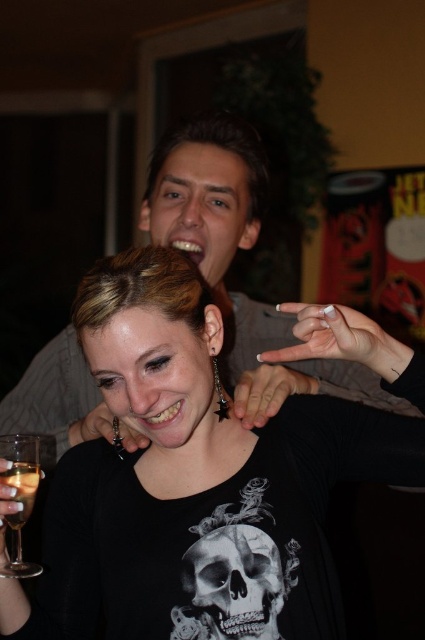
Question: Does clear glass wine glass at lower left have a lesser width compared to translucent glass wine at lower left?

Choices:
 (A) no
 (B) yes

Answer: (A)

Question: Which object is farther from the camera taking this photo?

Choices:
 (A) translucent glass wine at lower left
 (B) black matte skull at center

Answer: (A)

Question: Which point is farther to the camera?

Choices:
 (A) black matte skull at center
 (B) translucent glass wine at lower left
 (C) clear glass wine glass at lower left
 (D) black matte shirt at center

Answer: (B)

Question: Which object appears closest to the camera in this image?

Choices:
 (A) translucent glass wine at lower left
 (B) black matte skull at center

Answer: (B)

Question: Does black matte shirt at center have a greater width compared to black matte skull at center?

Choices:
 (A) yes
 (B) no

Answer: (A)

Question: Is black matte skull at center further to camera compared to translucent glass wine at lower left?

Choices:
 (A) no
 (B) yes

Answer: (A)